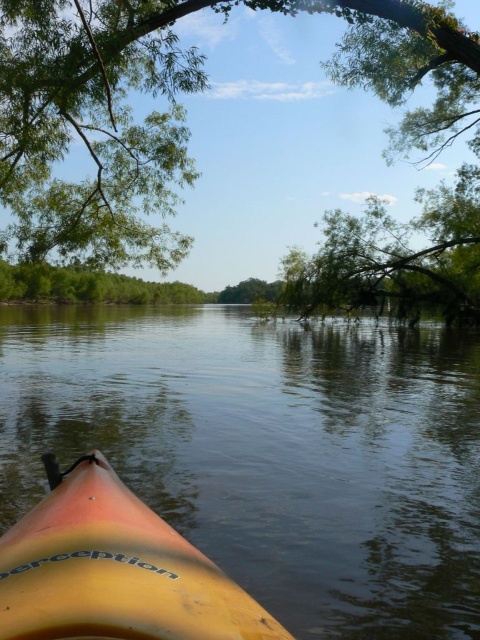
You are navigating a kayak on a calm river. You have two kayaks available, the yellow plastic kayak at lower left and the yellow matte kayak at lower left. Which kayak has a wider width that might provide more stability?

The yellow plastic kayak at lower left has a larger width than the yellow matte kayak at lower left, so it might provide more stability.

You are in a kayak and want to navigate through a narrow section of the river. The green leafy tree at upper center and the yellow matte kayak at lower left are visible. Which object takes up more horizontal space in the scene?

The green leafy tree at upper center takes up more horizontal space than the yellow matte kayak at lower left because its width is larger than the kayak.

You are in a kayak labeled Perception, facing the direction of the kayak. There are two points marked in the scene, point (26,131) and point (17,566). Which point is closer to you?

Point (17,566) is closer to you since it is in front of point (26,131).